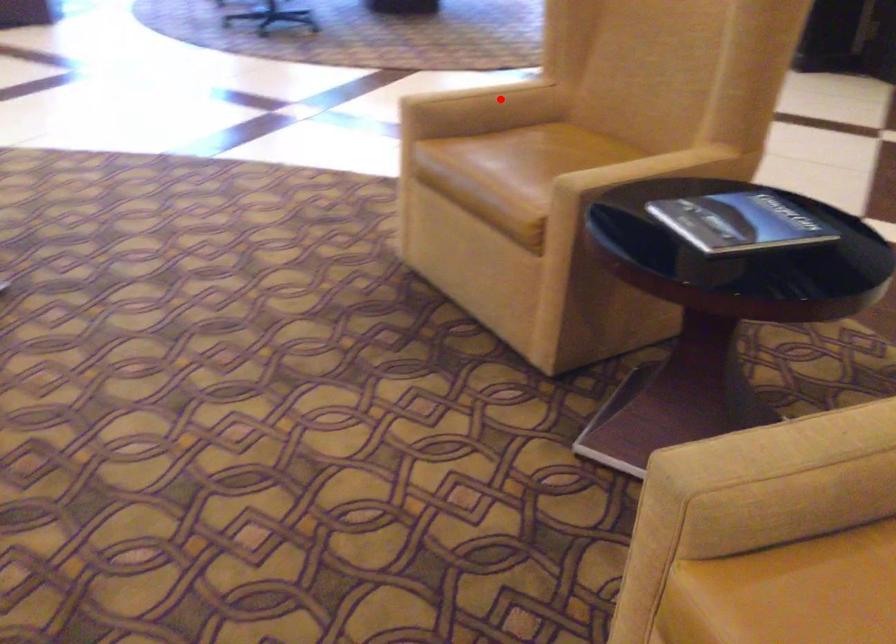
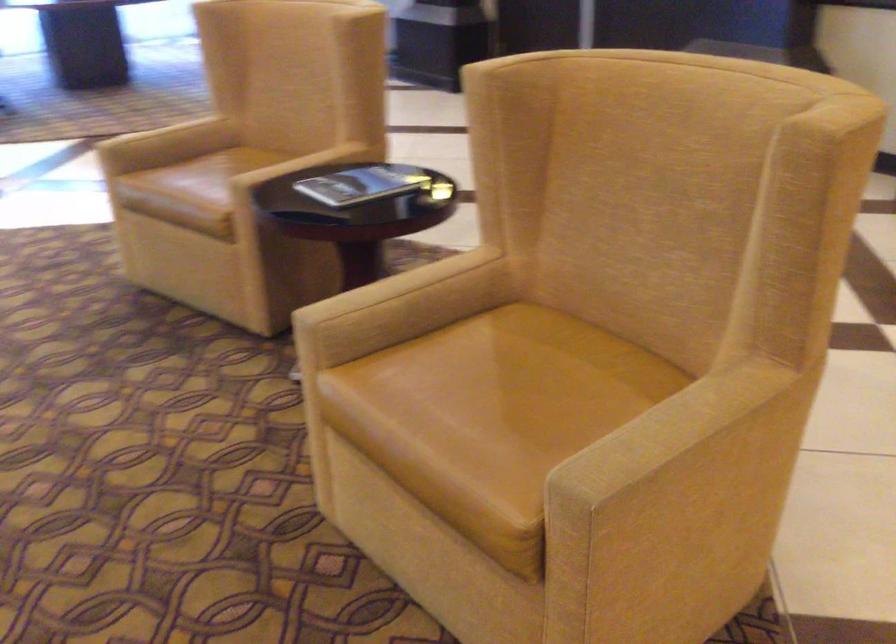
Question: I am providing you with two images of the same scene from different viewpoints. In image1, a red point is highlighted. Considering the same 3D point in image2, which of the following is correct?

Choices:
 (A) It is closer
 (B) It is farther

Answer: (B)